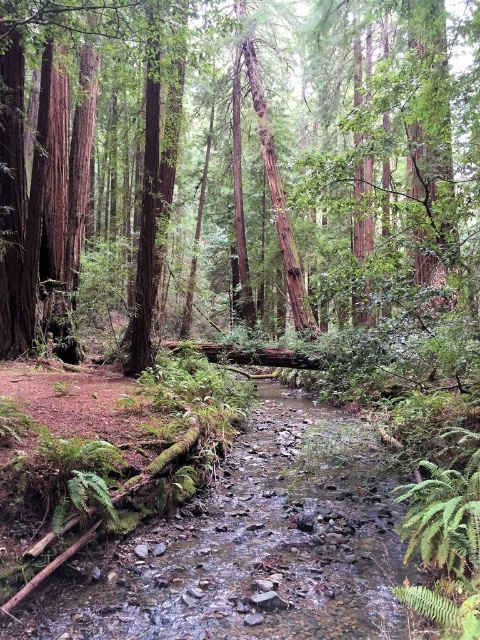
Question: Which point is farther to the camera?

Choices:
 (A) (396, 509)
 (B) (266, 56)

Answer: (B)

Question: From the image, what is the correct spatial relationship of smooth brown tree trunk at center in relation to smooth rock stream at center?

Choices:
 (A) left
 (B) right

Answer: (A)

Question: Which point appears farthest from the camera in this image?

Choices:
 (A) (418, 61)
 (B) (173, 538)

Answer: (A)

Question: Can you confirm if smooth brown tree trunk at center is positioned above smooth rock stream at center?

Choices:
 (A) yes
 (B) no

Answer: (A)

Question: Is smooth brown tree trunk at center further to camera compared to smooth rock stream at center?

Choices:
 (A) yes
 (B) no

Answer: (A)